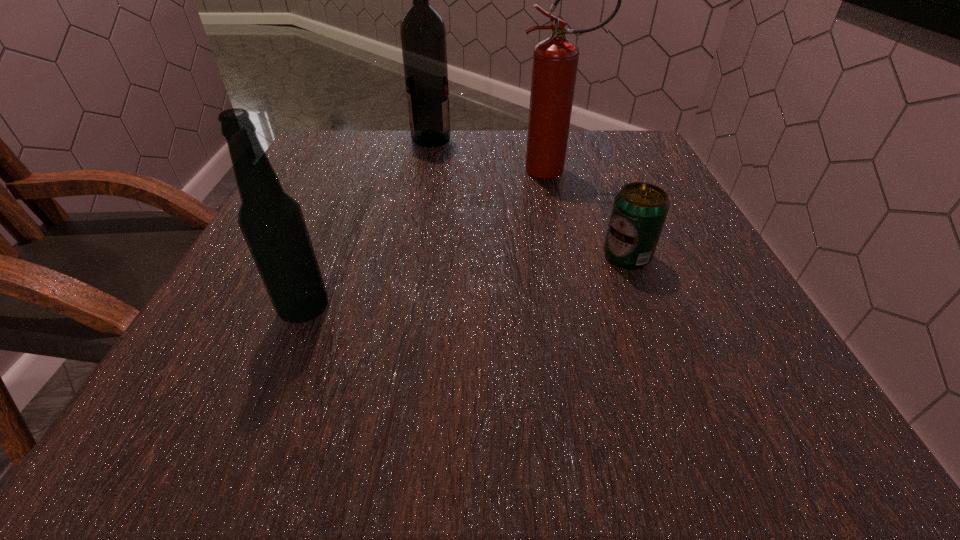
Locate an element on the screen. the farther alcohol is located at coordinates (423, 35).

This screenshot has height=540, width=960. In order to click on the taller alcohol in this screenshot , I will do `click(423, 35)`.

The width and height of the screenshot is (960, 540). Find the location of `fire extinguisher`. fire extinguisher is located at coordinates (555, 60).

Where is `the left alcohol`? The height and width of the screenshot is (540, 960). the left alcohol is located at coordinates (272, 223).

This screenshot has height=540, width=960. What are the coordinates of `the leftmost object` in the screenshot? It's located at (272, 223).

Locate an element on the screen. the shortest object is located at coordinates (639, 211).

You are a GUI agent. You are given a task and a screenshot of the screen. Output one action in this format:
    pyautogui.click(x=<x>, y=<y>)
    Task: Click on the third farthest object
    This screenshot has width=960, height=540.
    Given the screenshot: What is the action you would take?
    pyautogui.click(x=639, y=211)

This screenshot has width=960, height=540. Find the location of `vacant area situated 0.370m on the front and back of the farther alcohol`. vacant area situated 0.370m on the front and back of the farther alcohol is located at coordinates (599, 139).

The image size is (960, 540). Identify the location of vacant region located 0.110m from the nozzle of the third nearest object. (468, 171).

What are the coordinates of `free spot located 0.070m from the nozzle of the third nearest object` in the screenshot? It's located at (486, 171).